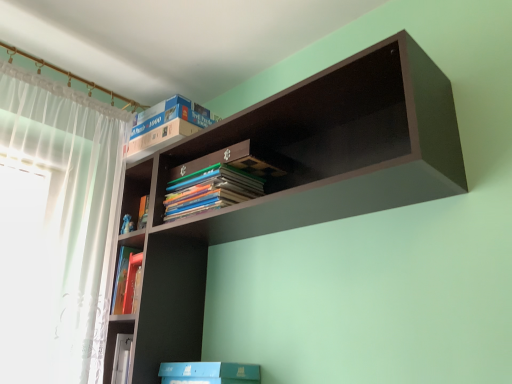
Question: Is blue cardboard box at upper center not near dark wood shelf at upper center?

Choices:
 (A) no
 (B) yes

Answer: (A)

Question: Is dark wood shelf at upper center located within blue cardboard box at upper center?

Choices:
 (A) no
 (B) yes

Answer: (A)

Question: Is blue cardboard box at upper center positioned in front of dark wood shelf at upper center?

Choices:
 (A) yes
 (B) no

Answer: (B)

Question: Is the position of blue cardboard box at upper center more distant than that of dark wood shelf at upper center?

Choices:
 (A) yes
 (B) no

Answer: (A)

Question: Considering the relative positions of blue cardboard box at upper center and dark wood shelf at upper center in the image provided, is blue cardboard box at upper center to the right of dark wood shelf at upper center from the viewer's perspective?

Choices:
 (A) no
 (B) yes

Answer: (A)

Question: Can you confirm if blue cardboard box at upper center is thinner than dark wood shelf at upper center?

Choices:
 (A) no
 (B) yes

Answer: (B)

Question: From the image's perspective, is dark wood shelf at upper center above blue cardboard box at upper center?

Choices:
 (A) no
 (B) yes

Answer: (A)

Question: From the image's perspective, is dark wood shelf at upper center below blue cardboard box at upper center?

Choices:
 (A) no
 (B) yes

Answer: (B)

Question: From a real-world perspective, is dark wood shelf at upper center under blue cardboard box at upper center?

Choices:
 (A) yes
 (B) no

Answer: (A)

Question: Considering the relative sizes of dark wood shelf at upper center and blue cardboard box at upper center in the image provided, is dark wood shelf at upper center bigger than blue cardboard box at upper center?

Choices:
 (A) no
 (B) yes

Answer: (B)

Question: Can you confirm if dark wood shelf at upper center is taller than blue cardboard box at upper center?

Choices:
 (A) yes
 (B) no

Answer: (A)

Question: Is dark wood shelf at upper center far away from blue cardboard box at upper center?

Choices:
 (A) yes
 (B) no

Answer: (B)

Question: In the image, is dark wood shelf at upper center positioned in front of or behind blue cardboard box at upper center?

Choices:
 (A) front
 (B) behind

Answer: (A)